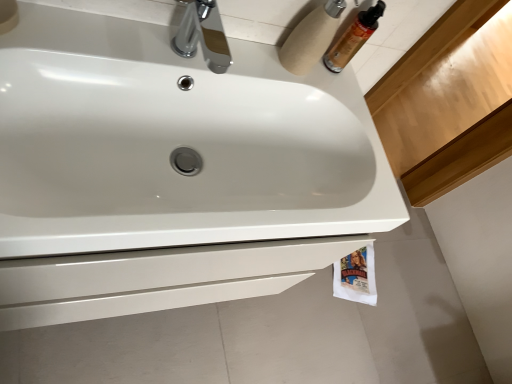
Question: Can you confirm if white cardboard toilet paper at upper right, arranged as the 1th toilet paper when viewed from the front, is positioned to the left of white paper towel at lower right, acting as the first toilet paper starting from the back?

Choices:
 (A) no
 (B) yes

Answer: (B)

Question: Does white cardboard toilet paper at upper right, which is the 2th toilet paper from right to left, have a greater width compared to white paper towel at lower right, arranged as the second toilet paper when viewed from the top?

Choices:
 (A) yes
 (B) no

Answer: (B)

Question: Considering the relative sizes of white cardboard toilet paper at upper right, placed as the second toilet paper when sorted from bottom to top, and white paper towel at lower right, arranged as the second toilet paper when viewed from the top, in the image provided, is white cardboard toilet paper at upper right, placed as the second toilet paper when sorted from bottom to top, thinner than white paper towel at lower right, arranged as the second toilet paper when viewed from the top,?

Choices:
 (A) no
 (B) yes

Answer: (B)

Question: Is white cardboard toilet paper at upper right, placed as the second toilet paper when sorted from bottom to top, oriented away from white paper towel at lower right, arranged as the second toilet paper when viewed from the top?

Choices:
 (A) no
 (B) yes

Answer: (A)

Question: Is white cardboard toilet paper at upper right, arranged as the 1th toilet paper when viewed from the front, next to white paper towel at lower right, arranged as the second toilet paper when viewed from the left?

Choices:
 (A) yes
 (B) no

Answer: (B)

Question: Is white cardboard toilet paper at upper right, arranged as the 1th toilet paper when viewed from the front, smaller than white paper towel at lower right, arranged as the second toilet paper when viewed from the top?

Choices:
 (A) no
 (B) yes

Answer: (B)

Question: Is translucent plastic mouthwash at upper right positioned behind white paper towel at lower right, arranged as the second toilet paper when viewed from the left?

Choices:
 (A) no
 (B) yes

Answer: (A)

Question: Is translucent plastic mouthwash at upper right at the left side of white paper towel at lower right, the 1th toilet paper when ordered from right to left?

Choices:
 (A) yes
 (B) no

Answer: (A)

Question: Can you confirm if translucent plastic mouthwash at upper right is taller than white paper towel at lower right, arranged as the second toilet paper when viewed from the top?

Choices:
 (A) yes
 (B) no

Answer: (A)

Question: Can we say translucent plastic mouthwash at upper right lies outside white paper towel at lower right, acting as the first toilet paper starting from the back?

Choices:
 (A) yes
 (B) no

Answer: (A)

Question: Is translucent plastic mouthwash at upper right thinner than white paper towel at lower right, acting as the first toilet paper starting from the back?

Choices:
 (A) no
 (B) yes

Answer: (B)

Question: Considering the relative sizes of translucent plastic mouthwash at upper right and white paper towel at lower right, acting as the first toilet paper starting from the back, in the image provided, is translucent plastic mouthwash at upper right bigger than white paper towel at lower right, acting as the first toilet paper starting from the back,?

Choices:
 (A) no
 (B) yes

Answer: (A)

Question: Is white cardboard toilet paper at upper right, placed as the second toilet paper when sorted from bottom to top, oriented towards white glossy sink at center?

Choices:
 (A) yes
 (B) no

Answer: (B)